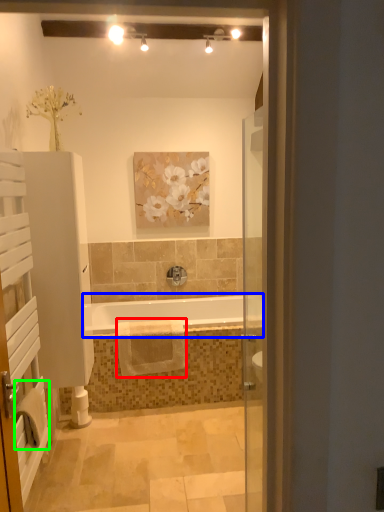
Question: Considering the real-world distances, which object is closest to bath towel (highlighted by a red box)? bathtub (highlighted by a blue box) or bath towel (highlighted by a green box).

Choices:
 (A) bathtub
 (B) bath towel

Answer: (A)